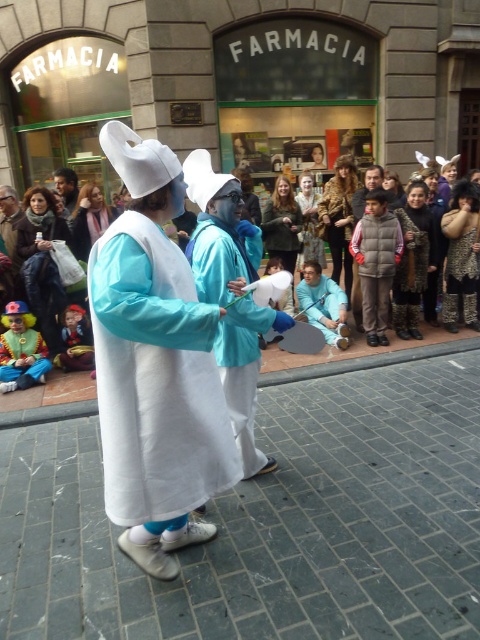
Is white fabric at center to the right of matte white mask at center from the viewer's perspective?

Correct, you'll find white fabric at center to the right of matte white mask at center.

Is white fabric at center further to the viewer compared to matte white mask at center?

No, it is in front of matte white mask at center.

Image resolution: width=480 pixels, height=640 pixels. I want to click on white fabric at center, so click(x=269, y=522).

Image resolution: width=480 pixels, height=640 pixels. Identify the location of white fabric at center. click(x=269, y=522).

Does gray puffy vest at center have a greater height compared to matte white mask at center?

No.

At what (x,y) coordinates should I click in order to perform the action: click on gray puffy vest at center. Please return your answer as a coordinate pair (x, y). Looking at the image, I should click on (365, 189).

Does white fabric at center appear over matte white coat at center?

Actually, white fabric at center is below matte white coat at center.

Who is more forward, (439, 618) or (48, 376)?

Point (439, 618) is more forward.

The height and width of the screenshot is (640, 480). What do you see at coordinates (269, 522) in the screenshot? I see `white fabric at center` at bounding box center [269, 522].

Where is `white fabric at center`? The height and width of the screenshot is (640, 480). white fabric at center is located at coordinates (269, 522).